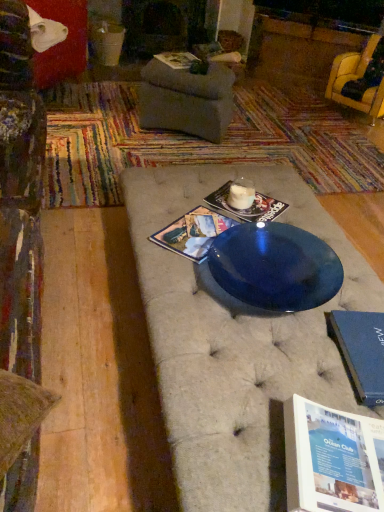
This screenshot has width=384, height=512. Identify the location of vacant position to the left of gray fabric footrest at center. (112, 118).